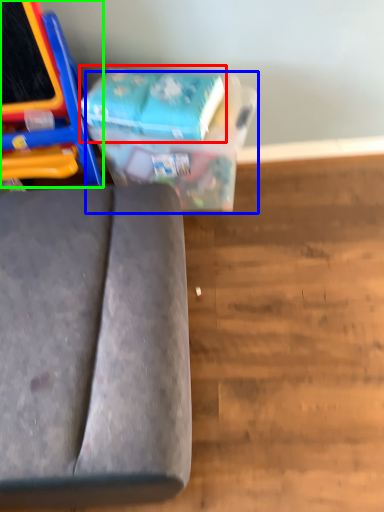
Question: Which is farther away from paperback book (highlighted by a red box)? cardboard box (highlighted by a blue box) or furniture (highlighted by a green box)?

Choices:
 (A) cardboard box
 (B) furniture

Answer: (B)